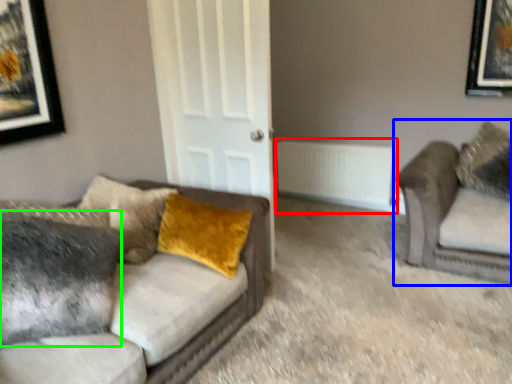
Question: Considering the real-world distances, which object is closest to radiator (highlighted by a red box)? studio couch (highlighted by a blue box) or pillow (highlighted by a green box).

Choices:
 (A) studio couch
 (B) pillow

Answer: (A)